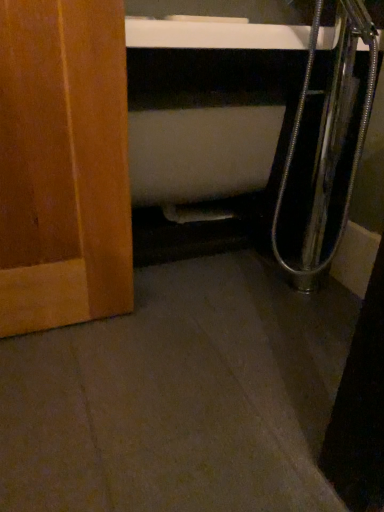
Find the location of a particular element. vacant space in front of metallic silver showerhead at right is located at coordinates [307, 328].